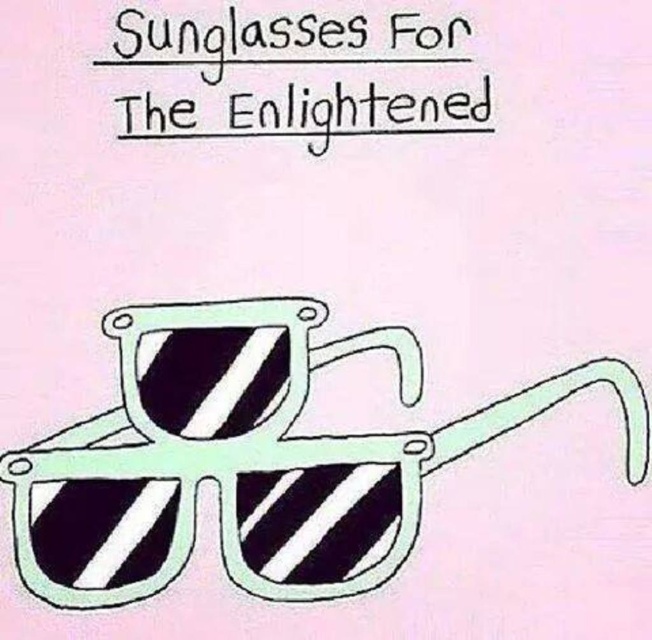
You are designing a poster and need to know the arrangement of the elements. Are the white striped plastic sunglasses at center placed above or below the black paper at upper center?

The white striped plastic sunglasses at center is positioned under the black paper at upper center, so it is placed below.

You are an artist trying to frame a picture. You have a white striped plastic sunglasses at center and a black paper at upper center. Which object should you choose if you want something larger to cover more of the background?

The white striped plastic sunglasses at center is bigger than the black paper at upper center, so you should choose the white striped plastic sunglasses at center to cover more of the background.